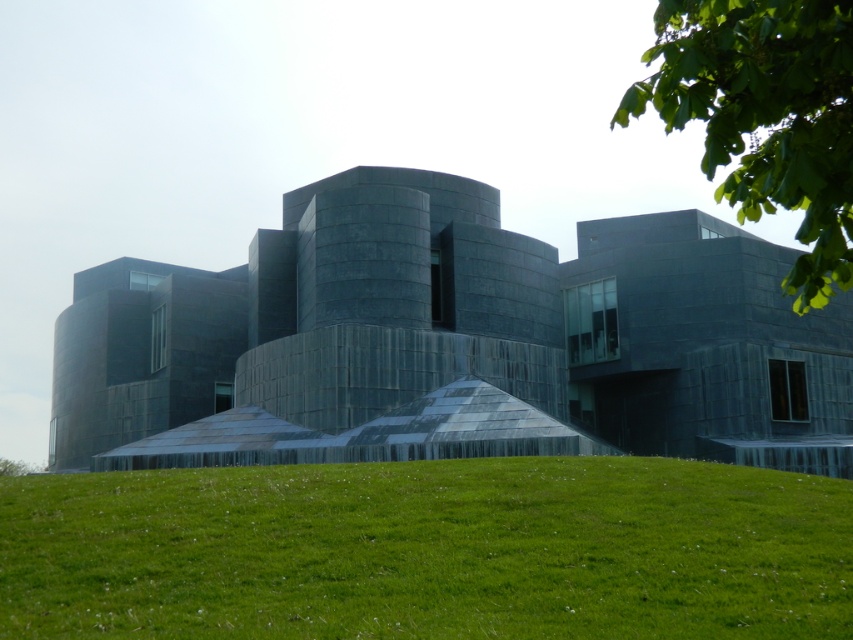
Question: Does dark gray stone building at center appear on the right side of green grass at lower center?

Choices:
 (A) yes
 (B) no

Answer: (B)

Question: Which object appears closest to the camera in this image?

Choices:
 (A) green leafy tree at upper right
 (B) dark gray stone building at center
 (C) green grass at lower center

Answer: (A)

Question: Which object is farther from the camera taking this photo?

Choices:
 (A) dark gray stone building at center
 (B) green grass at lower center
 (C) green leafy tree at upper right

Answer: (A)

Question: Based on their relative distances, which object is farther from the green leafy tree at upper right?

Choices:
 (A) dark gray stone building at center
 (B) green grass at lower center

Answer: (A)

Question: Can you confirm if dark gray stone building at center is smaller than green leafy tree at upper right?

Choices:
 (A) yes
 (B) no

Answer: (A)

Question: Does dark gray stone building at center have a greater width compared to green grass at lower center?

Choices:
 (A) no
 (B) yes

Answer: (B)